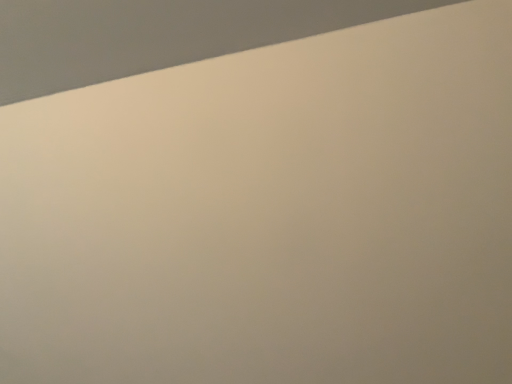
The image size is (512, 384). Identify the location of white matte wall at upper left. (156, 35).

Describe the element at coordinates (156, 35) in the screenshot. I see `white matte wall at upper left` at that location.

Find the location of a particular element. The width and height of the screenshot is (512, 384). white matte wall at upper left is located at coordinates (156, 35).